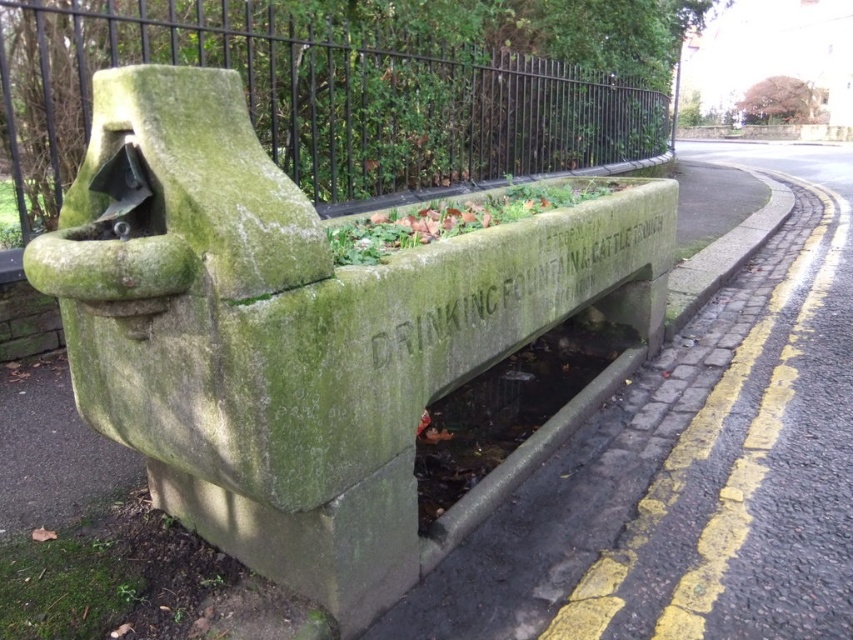
You are a pedestrian walking along the road and see the green mossy stone drinking fountain at center and the green stone fence at upper left. Which object is closer to the road?

The green mossy stone drinking fountain at center is closer to the road because it is positioned below the green stone fence at upper left, meaning it is situated lower and nearer to the road level.

You are a delivery driver who needs to park your truck near the green stone drinking fountain at lower center. The parking area must be at least 10 meters long. Can you park your truck here?

The green stone drinking fountain at lower center is positioned at point [692,467]. Since the parking area must be at least 10 meters long and the fountain is located near the road edge, there might not be enough space. Check the road layout for a suitable parking spot.

You are a delivery person with a 2.5 meter wide truck. You need to park your truck between the green mossy stone drinking fountain at center and the green stone fence at upper left. Is there enough space for your truck?

The distance between the green mossy stone drinking fountain at center and the green stone fence at upper left is 3.09 meters. Since the truck is 2.5 meters wide, there is enough space to park between them.